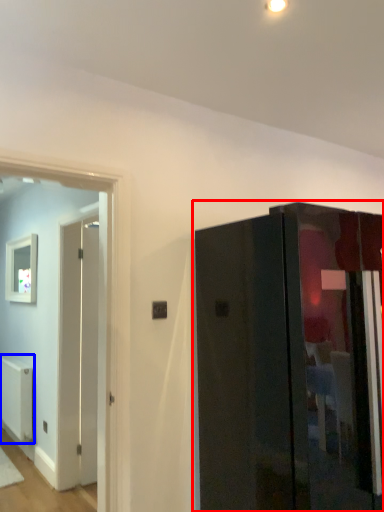
Question: Which object is further to the camera taking this photo, door (highlighted by a red box) or radiator (highlighted by a blue box)?

Choices:
 (A) door
 (B) radiator

Answer: (B)